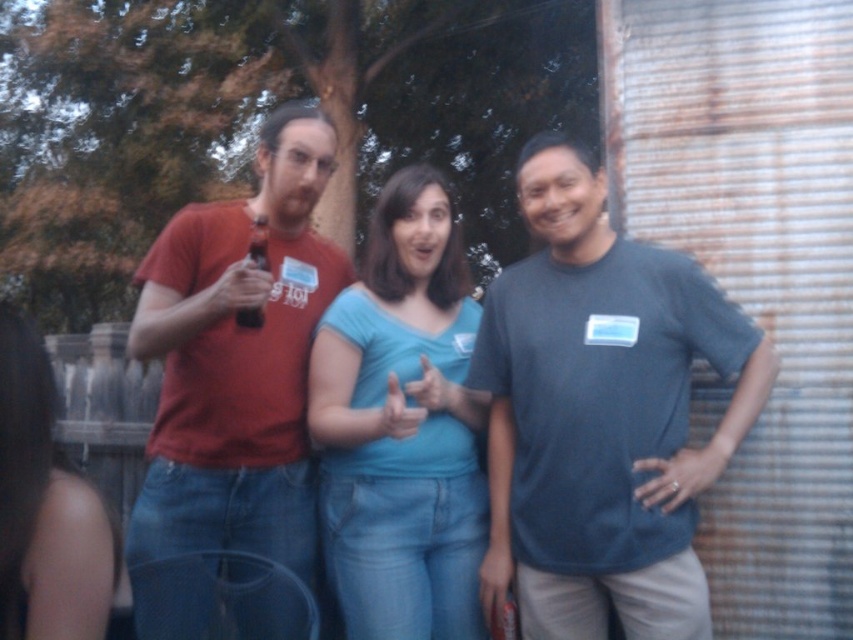
You are standing at the point marked by coordinates point (503, 506). You want to walk straight towards the nearest person. Which person are you closest to?

The distance of point (503, 506) from viewer is 2.75 meters. The nearest person would be the one closest to this point. Since the person on the right is positioned at the farthest point from the viewer, the closest person would be the one in the center.

You are at a party and want to pass a small item from the blue cotton shirt at center to the matte plastic bottle at center. Can you do it without moving from your current position?

The blue cotton shirt at center is 18.26 inches away from the matte plastic bottle at center, so yes, you can pass the item without moving since the distance is manageable.

You are organizing a photo shoot and need to arrange the matte red shirt at left and the blue cotton shirt at center in a line. If you want to place them in order from tallest to shortest, which order should you follow?

The matte red shirt at left has a greater height compared to the blue cotton shirt at center, so you should arrange them from tallest to shortest as matte red shirt at left first, then blue cotton shirt at center.